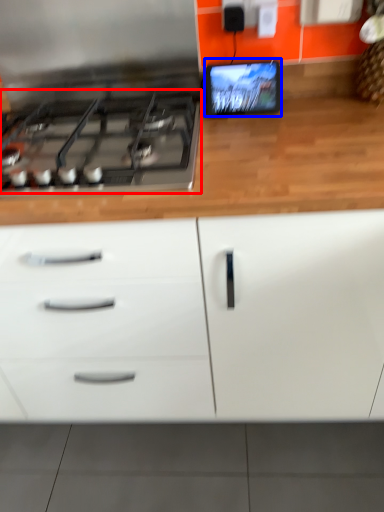
Question: Which object is further to the camera taking this photo, gas stove (highlighted by a red box) or computer monitor (highlighted by a blue box)?

Choices:
 (A) gas stove
 (B) computer monitor

Answer: (B)